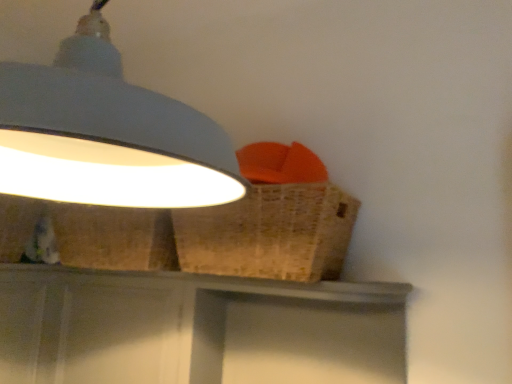
What do you see at coordinates (196, 329) in the screenshot? The width and height of the screenshot is (512, 384). I see `matte gray vanity at center` at bounding box center [196, 329].

The width and height of the screenshot is (512, 384). Find the location of `matte gray vanity at center`. matte gray vanity at center is located at coordinates (196, 329).

The height and width of the screenshot is (384, 512). What do you see at coordinates (106, 134) in the screenshot? I see `white matte lampshade at upper left` at bounding box center [106, 134].

Identify the location of woven brown basket at upper right. The width and height of the screenshot is (512, 384). (270, 233).

How different are the orientations of matte gray vanity at center and white matte lampshade at upper left in degrees?

There is a 84.9-degree angle between the facing directions of matte gray vanity at center and white matte lampshade at upper left.

Is matte gray vanity at center behind white matte lampshade at upper left?

Yes, it is behind white matte lampshade at upper left.

From a real-world perspective, is matte gray vanity at center above or below white matte lampshade at upper left?

Clearly, from a real-world perspective, matte gray vanity at center is below white matte lampshade at upper left.

Looking at this image, how much distance is there between matte gray vanity at center and white matte lampshade at upper left?

matte gray vanity at center is 23.38 inches from white matte lampshade at upper left.

From the image's perspective, is matte gray vanity at center beneath woven brown basket at upper right?

Yes.

Which of these two, matte gray vanity at center or woven brown basket at upper right, stands taller?

matte gray vanity at center is taller.

Are matte gray vanity at center and woven brown basket at upper right located far from each other?

They are positioned close to each other.

Which point is more forward, (306, 369) or (337, 252)?

The point (337, 252) is closer.

From a real-world perspective, is woven brown basket at upper right positioned under matte gray vanity at center based on gravity?

No.

From the picture: Considering the sizes of woven brown basket at upper right and matte gray vanity at center in the image, is woven brown basket at upper right wider or thinner than matte gray vanity at center?

woven brown basket at upper right is wider than matte gray vanity at center.

In the scene shown: Is matte gray vanity at center at the back of woven brown basket at upper right?

woven brown basket at upper right does not have its back to matte gray vanity at center.

Is point (106, 138) more distant than point (322, 196)?

No.

Which is more to the left, white matte lampshade at upper left or woven brown basket at upper right?

From the viewer's perspective, white matte lampshade at upper left appears more on the left side.

Between white matte lampshade at upper left and woven brown basket at upper right, which one has more height?

white matte lampshade at upper left.

From the image's perspective, is white matte lampshade at upper left positioned above or below woven brown basket at upper right?

white matte lampshade at upper left is above woven brown basket at upper right.

Is white matte lampshade at upper left facing away from matte gray vanity at center?

No.

Where is `vanity below the white matte lampshade at upper left (from a real-world perspective)`? vanity below the white matte lampshade at upper left (from a real-world perspective) is located at coordinates (196, 329).

From a real-world perspective, is white matte lampshade at upper left above or below matte gray vanity at center?

From a real-world perspective, white matte lampshade at upper left is physically above matte gray vanity at center.

Based on the photo, is woven brown basket at upper right smaller than white matte lampshade at upper left?

Correct, woven brown basket at upper right occupies less space than white matte lampshade at upper left.

From the image's perspective, between woven brown basket at upper right and white matte lampshade at upper left, which one is located above?

white matte lampshade at upper left is shown above in the image.

Looking at this image, from a real-world perspective, does woven brown basket at upper right sit lower than white matte lampshade at upper left?

Yes, from a real-world perspective, woven brown basket at upper right is beneath white matte lampshade at upper left.

Can you confirm if woven brown basket at upper right is taller than white matte lampshade at upper left?

Incorrect, the height of woven brown basket at upper right is not larger of that of white matte lampshade at upper left.

The height and width of the screenshot is (384, 512). Find the location of `vanity that is on the right side of white matte lampshade at upper left`. vanity that is on the right side of white matte lampshade at upper left is located at coordinates (196, 329).

At what (x,y) coordinates should I click in order to perform the action: click on basket on the left of matte gray vanity at center. Please return your answer as a coordinate pair (x, y). This screenshot has width=512, height=384. Looking at the image, I should click on (270, 233).

Estimate the real-world distances between objects in this image. Which object is further from woven brown basket at upper right, matte gray vanity at center or white matte lampshade at upper left?

The object further to woven brown basket at upper right is white matte lampshade at upper left.

When comparing their distances from matte gray vanity at center, does woven brown basket at upper right or white matte lampshade at upper left seem further?

white matte lampshade at upper left is further to matte gray vanity at center.

Which object lies nearer to the anchor point matte gray vanity at center, white matte lampshade at upper left or woven brown basket at upper right?

The object closer to matte gray vanity at center is woven brown basket at upper right.

Estimate the real-world distances between objects in this image. Which object is closer to white matte lampshade at upper left, matte gray vanity at center or woven brown basket at upper right?

woven brown basket at upper right is closer to white matte lampshade at upper left.

Considering their positions, is white matte lampshade at upper left positioned further to woven brown basket at upper right than matte gray vanity at center?

white matte lampshade at upper left is positioned further to the anchor woven brown basket at upper right.

When comparing their distances from white matte lampshade at upper left, does woven brown basket at upper right or matte gray vanity at center seem further?

matte gray vanity at center is further to white matte lampshade at upper left.

I want to click on basket located between white matte lampshade at upper left and matte gray vanity at center in the depth direction, so click(270, 233).